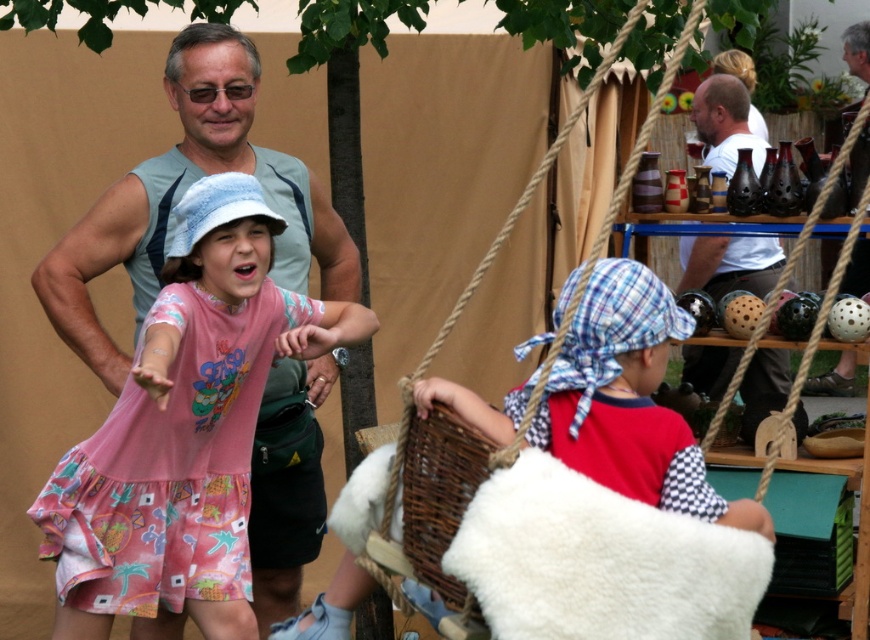
Question: Among these objects, which one is nearest to the camera?

Choices:
 (A) pink cotton dress at center
 (B) woven brown basket at lower center
 (C) plaid fabric headscarf at center

Answer: (B)

Question: Is pink cotton dress at center thinner than plaid fabric headscarf at center?

Choices:
 (A) yes
 (B) no

Answer: (B)

Question: Which point is farther to the camera?

Choices:
 (A) (705, 113)
 (B) (233, 524)
 (C) (641, 454)

Answer: (A)

Question: Is plaid fabric headscarf at center smaller than woven brown basket at lower center?

Choices:
 (A) yes
 (B) no

Answer: (B)

Question: Which object appears farthest from the camera in this image?

Choices:
 (A) pink cotton dress at center
 (B) woven brown basket at lower center
 (C) plaid fabric headscarf at center

Answer: (A)

Question: Does plaid fabric headscarf at center appear on the right side of white cotton shirt at upper right?

Choices:
 (A) yes
 (B) no

Answer: (B)